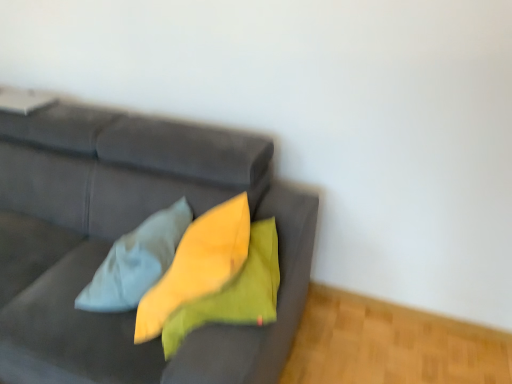
The height and width of the screenshot is (384, 512). In order to click on matte gray couch at center in this screenshot , I will do `click(124, 233)`.

Measure the distance between point [278,227] and camera.

They are 5.15 feet apart.

Describe the element at coordinates (124, 233) in the screenshot. I see `matte gray couch at center` at that location.

What is the approximate width of matte gray couch at center?

matte gray couch at center is 4.35 feet in width.

This screenshot has height=384, width=512. In order to click on matte gray couch at center in this screenshot , I will do `click(124, 233)`.